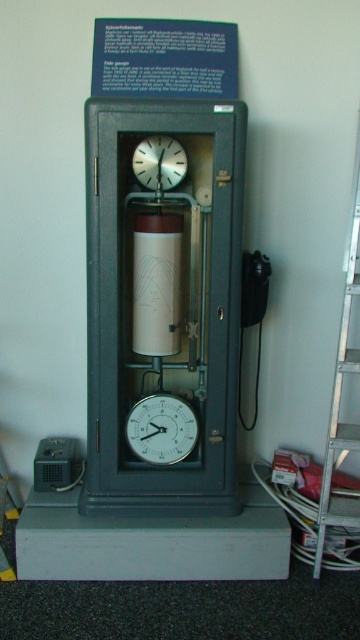
Question: Does white matte clock at center lie in front of white metallic clock at upper center?

Choices:
 (A) yes
 (B) no

Answer: (B)

Question: Estimate the real-world distances between objects in this image. Which object is farther from the silver metallic ladder at right?

Choices:
 (A) white matte clock at center
 (B) white metallic clock at upper center

Answer: (B)

Question: Which point is closer to the camera?

Choices:
 (A) [141, 428]
 (B) [357, 273]

Answer: (B)

Question: Which object is the closest to the white metallic clock at upper center?

Choices:
 (A) silver metallic ladder at right
 (B) white matte clock at center

Answer: (A)

Question: Is the position of white matte clock at center less distant than that of white metallic clock at upper center?

Choices:
 (A) yes
 (B) no

Answer: (B)

Question: Observing the image, what is the correct spatial positioning of silver metallic ladder at right in reference to white matte clock at center?

Choices:
 (A) right
 (B) left

Answer: (A)